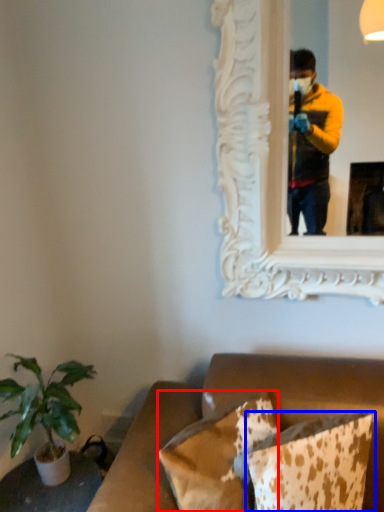
Question: Which object is closer to the camera taking this photo, pillow (highlighted by a red box) or pillow (highlighted by a blue box)?

Choices:
 (A) pillow
 (B) pillow

Answer: (B)